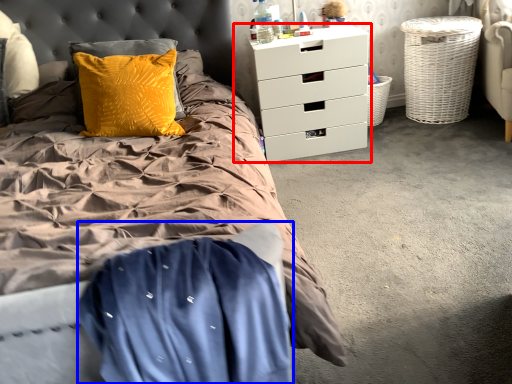
Question: Which object is further to the camera taking this photo, chest of drawers (highlighted by a red box) or blanket (highlighted by a blue box)?

Choices:
 (A) chest of drawers
 (B) blanket

Answer: (A)